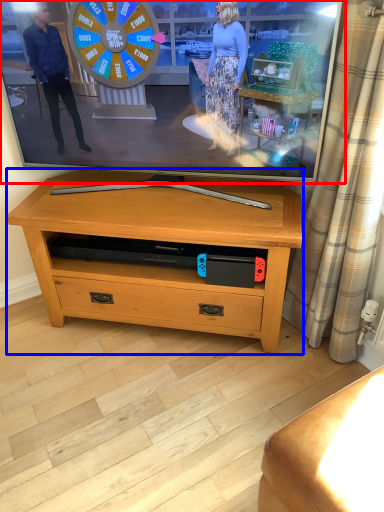
Question: Which object appears farthest to the camera in this image, television (highlighted by a red box) or table (highlighted by a blue box)?

Choices:
 (A) television
 (B) table

Answer: (B)